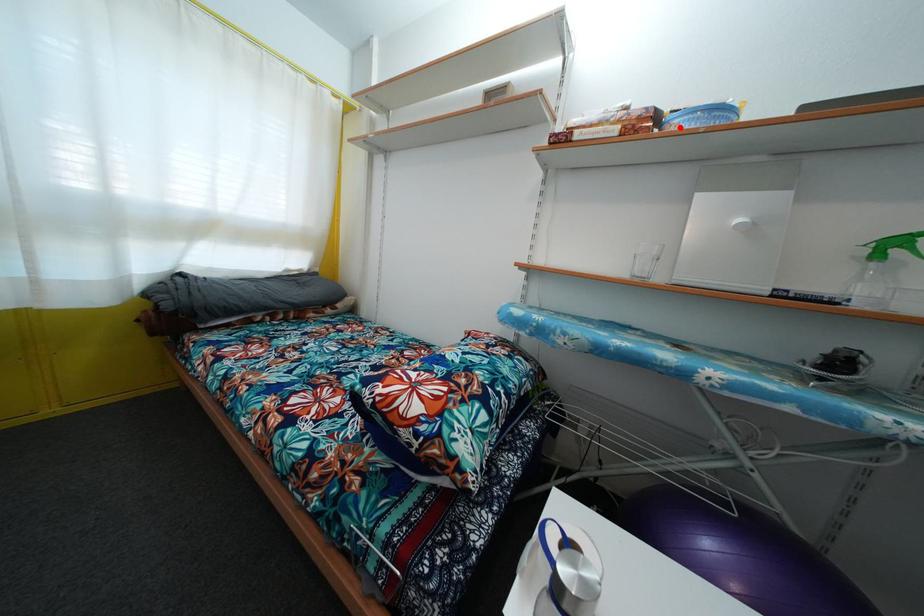
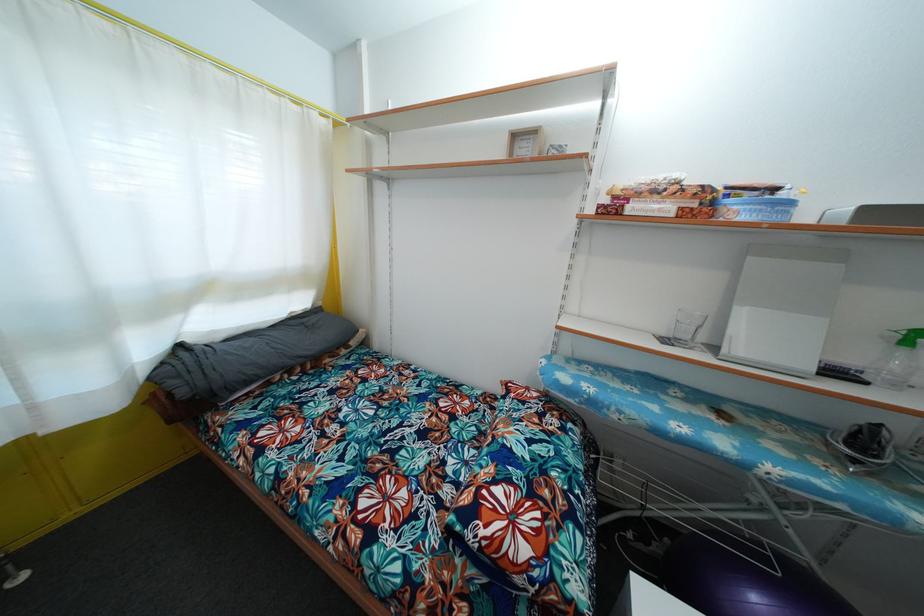
In the second image, find the point that corresponds to the highlighted location in the first image.

(738, 214)